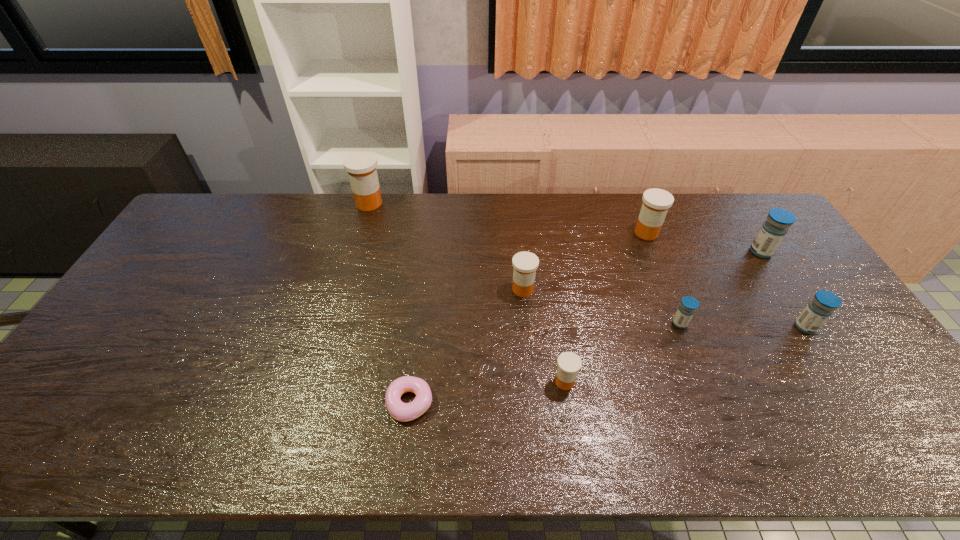
Where is `the nearest orange medicine`? the nearest orange medicine is located at coordinates (569, 363).

Find the location of `the nearest medicine`. the nearest medicine is located at coordinates (569, 363).

Locate an element on the screen. Image resolution: width=960 pixels, height=540 pixels. the shortest object is located at coordinates (401, 411).

Where is `doughnut`? The width and height of the screenshot is (960, 540). doughnut is located at coordinates (401, 411).

Where is `vacant area situated on the label of the leftmost medicine`? The width and height of the screenshot is (960, 540). vacant area situated on the label of the leftmost medicine is located at coordinates (415, 203).

Locate an element on the screen. vacant space located 0.070m on the label of the rightmost orange medicine is located at coordinates (656, 256).

I want to click on vacant space situated on the back of the biggest blue medicine, so click(725, 197).

What are the coordinates of `vacant space located 0.100m on the label of the fifth nearest object` in the screenshot? It's located at (477, 289).

Locate an element on the screen. The height and width of the screenshot is (540, 960). vacant space located on the label of the fifth nearest object is located at coordinates (404, 289).

Where is `free space located 0.390m on the label of the fifth nearest object`? free space located 0.390m on the label of the fifth nearest object is located at coordinates (381, 289).